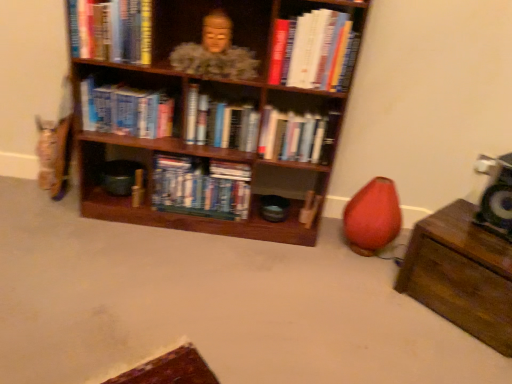
Locate an element on the screen. This screenshot has width=512, height=384. free space between wooden bookshelf at center and brown wooden chest at lower right is located at coordinates (296, 264).